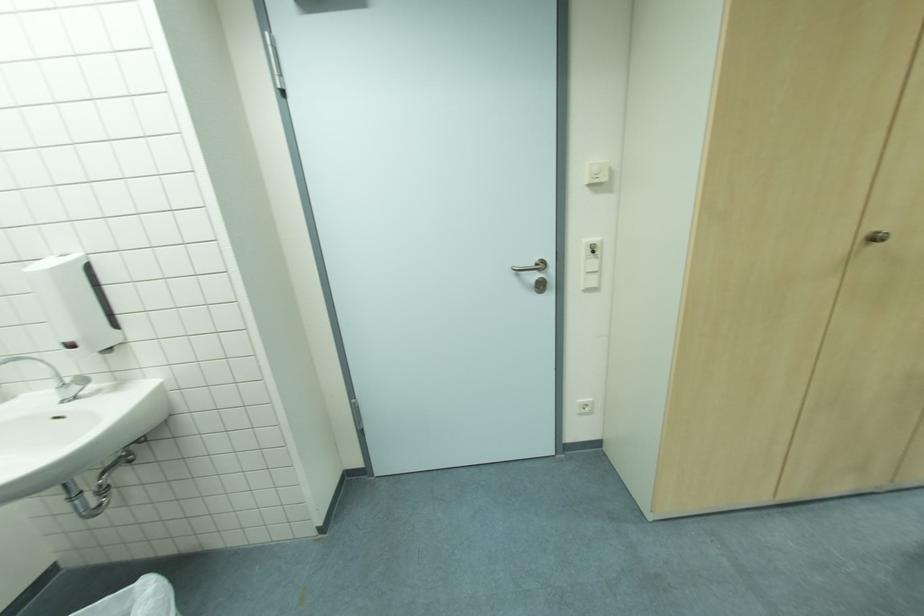
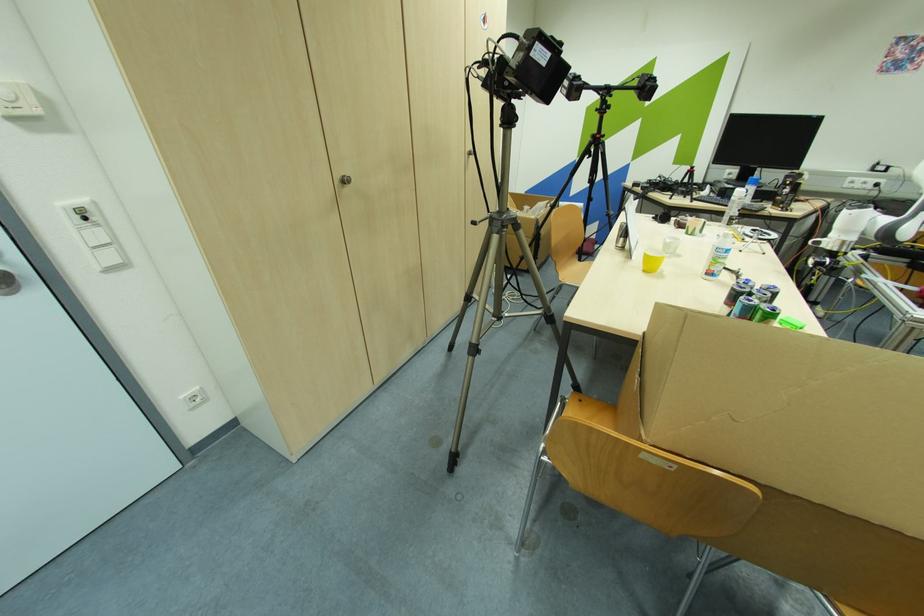
The point at (596, 265) is marked in the first image. Where is the corresponding point in the second image?

(102, 236)